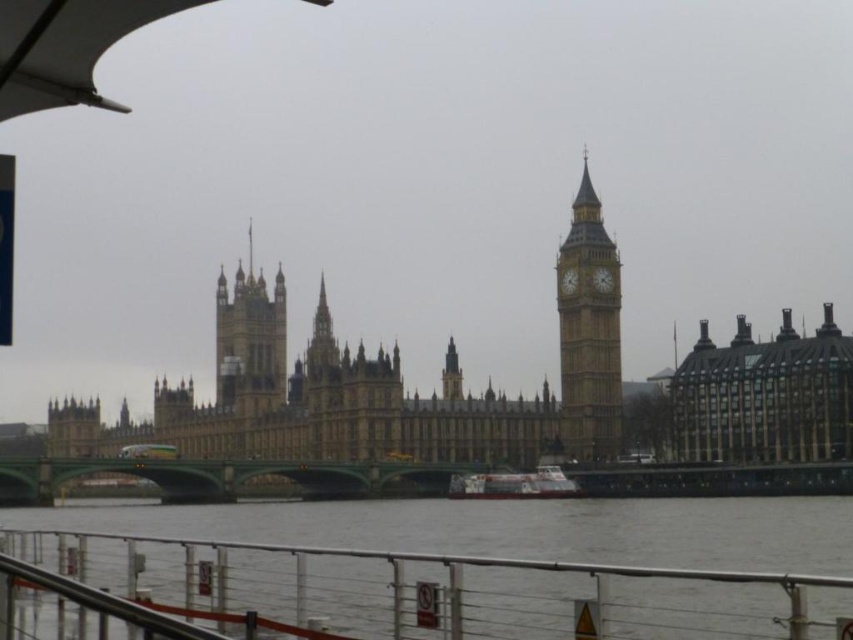
You are a tourist standing on the bridge and want to take a photo that includes both the dark brown stone building at right and the golden stone clock tower at right. Which object should you position closer to the bottom of your camera frame?

You should position the dark brown stone building at right closer to the bottom of your camera frame because it is positioned under the golden stone clock tower at right.

You are a tourist standing on the green concrete bridge at lower center and want to take a photo of the white plastic boat at center. Since the bridge is wider than the boat, can you step onto the boat to get a better angle?

→ The green concrete bridge at lower center is wider than the white plastic boat at center, so stepping onto the boat might not be safe due to its smaller size compared to the bridge.

You are a tourist visiting London and want to take a photo of the Houses of Parliament and Big Ben. You are standing on the green concrete bridge at lower center. Can you see the white plastic boat at center from your position?

The green concrete bridge at lower center is larger than the white plastic boat at center, so yes, you can see the white plastic boat at center from your position on the green concrete bridge at lower center because size does not affect visibility but placement does. However, since the bridge is in the foreground, you would likely have a clear view of the boat if it is positioned in the center of your sightline.